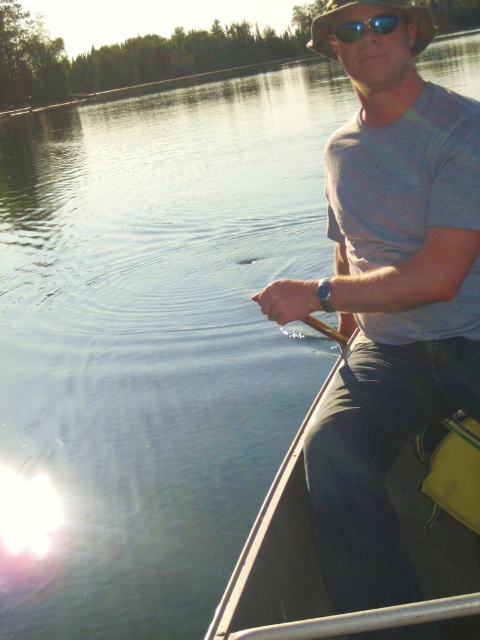
You are a photographer trying to capture the scene of the smooth gray canoe at right and the blue reflective lens sunglasses at upper center. Which object should you focus on first if you want to start with the one closer to the center of the image?

The blue reflective lens sunglasses at upper center is closer to the center of the image, so you should focus on it first.

You are a photographer taking a picture of the canoe scene. You notice two points in the image at coordinates point [392,211] and point [346,38]. Which point is closer to your camera?

Point [346,38] is closer to the camera because it is less further than point [392,211].